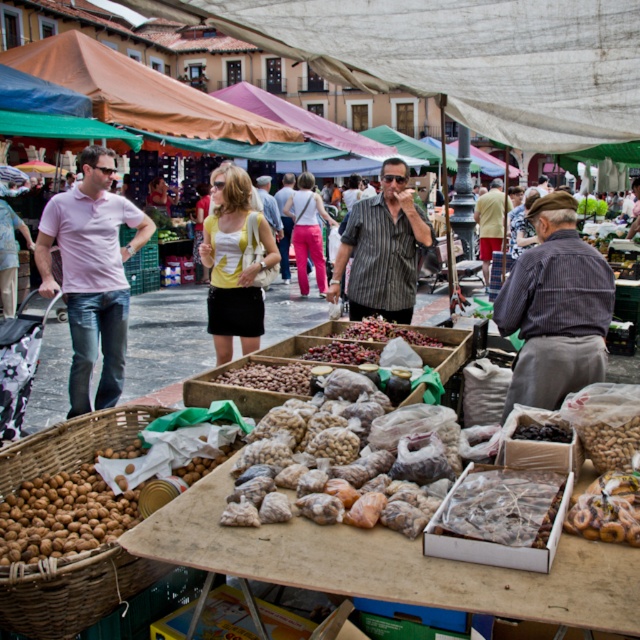
You are a customer at the market and want to pick up the translucent plastic bags at center and the pink shirt at left. Which item will you need to reach for first due to its proximity to you?

The translucent plastic bags at center are closer to the viewer than the pink shirt at left, so you should reach for the translucent plastic bags at center first.

You are a customer at the market and want to buy some nuts. The vendor tells you that the brown woven basket at center can hold exactly 2 liters. If the brown matte nuts at center currently occupy half of the basket, how many liters of nuts are there?

The brown matte nuts at center currently occupy half of the brown woven basket at center, which can hold exactly 2 liters. Therefore, there are 1 liter of nuts in the brown matte nuts at center.